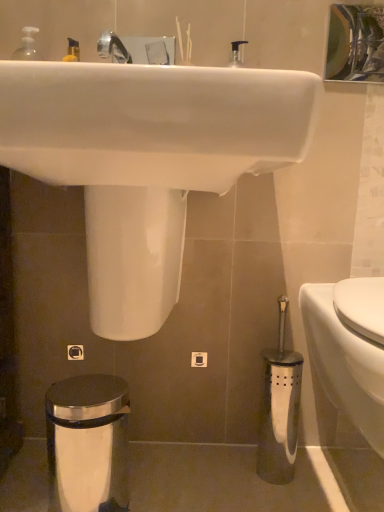
Question: Is metallic reflective mirror at upper center closer to the viewer compared to white glossy toilet at lower right?

Choices:
 (A) no
 (B) yes

Answer: (A)

Question: Can you confirm if metallic reflective mirror at upper center is bigger than white glossy toilet at lower right?

Choices:
 (A) no
 (B) yes

Answer: (A)

Question: Are metallic reflective mirror at upper center and white glossy toilet at lower right making contact?

Choices:
 (A) yes
 (B) no

Answer: (B)

Question: Would you say white glossy toilet at lower right is part of metallic reflective mirror at upper center's contents?

Choices:
 (A) no
 (B) yes

Answer: (A)

Question: Can you confirm if metallic reflective mirror at upper center is thinner than white glossy toilet at lower right?

Choices:
 (A) no
 (B) yes

Answer: (B)

Question: Is metallic reflective mirror at upper center oriented towards white glossy toilet at lower right?

Choices:
 (A) no
 (B) yes

Answer: (A)

Question: From the image's perspective, does white glossy sink at upper center appear higher than metallic reflective mirror at upper center?

Choices:
 (A) yes
 (B) no

Answer: (B)

Question: From a real-world perspective, is white glossy sink at upper center under metallic reflective mirror at upper center?

Choices:
 (A) no
 (B) yes

Answer: (B)

Question: Is metallic reflective mirror at upper center completely or partially inside white glossy sink at upper center?

Choices:
 (A) yes
 (B) no

Answer: (B)

Question: Is white glossy sink at upper center at the right side of metallic reflective mirror at upper center?

Choices:
 (A) yes
 (B) no

Answer: (B)

Question: Is white glossy sink at upper center positioned far away from metallic reflective mirror at upper center?

Choices:
 (A) yes
 (B) no

Answer: (A)

Question: Is the position of white glossy sink at upper center more distant than that of metallic reflective mirror at upper center?

Choices:
 (A) yes
 (B) no

Answer: (B)

Question: Can you confirm if satin chrome trash can at lower left is positioned to the right of metallic reflective mirror at upper center?

Choices:
 (A) no
 (B) yes

Answer: (A)